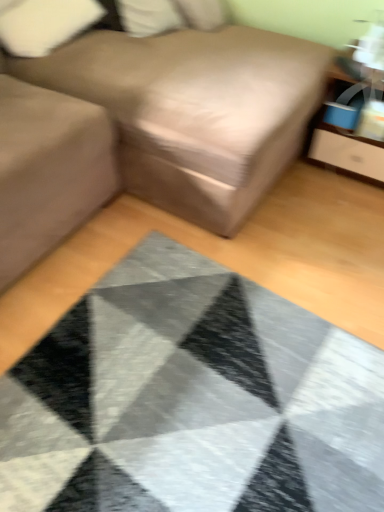
Question: Considering the relative sizes of matte gray sofa at left and white soft pillow at upper center, the first pillow in the right-to-left sequence, in the image provided, is matte gray sofa at left bigger than white soft pillow at upper center, the first pillow in the right-to-left sequence,?

Choices:
 (A) no
 (B) yes

Answer: (B)

Question: From the image's perspective, does matte gray sofa at left appear lower than white soft pillow at upper center, positioned as the 2th pillow in left-to-right order?

Choices:
 (A) yes
 (B) no

Answer: (A)

Question: Is white soft pillow at upper center, positioned as the 2th pillow in left-to-right order, surrounded by matte gray sofa at left?

Choices:
 (A) yes
 (B) no

Answer: (B)

Question: Can you see matte gray sofa at left touching white soft pillow at upper center, positioned as the 2th pillow in left-to-right order?

Choices:
 (A) no
 (B) yes

Answer: (A)

Question: From a real-world perspective, is matte gray sofa at left located higher than white soft pillow at upper center, the first pillow in the right-to-left sequence?

Choices:
 (A) no
 (B) yes

Answer: (A)

Question: Could you tell me if matte gray sofa at left is turned towards white soft pillow at upper center, the first pillow in the right-to-left sequence?

Choices:
 (A) yes
 (B) no

Answer: (B)

Question: Can you confirm if matte wood dresser at upper right is smaller than white fabric pillow at upper left, the first pillow in the left-to-right sequence?

Choices:
 (A) yes
 (B) no

Answer: (B)

Question: From a real-world perspective, is matte wood dresser at upper right on top of white fabric pillow at upper left, placed as the second pillow when sorted from right to left?

Choices:
 (A) yes
 (B) no

Answer: (B)

Question: Does matte wood dresser at upper right have a lesser height compared to white fabric pillow at upper left, the first pillow in the left-to-right sequence?

Choices:
 (A) yes
 (B) no

Answer: (B)

Question: Is matte wood dresser at upper right oriented away from white fabric pillow at upper left, the first pillow in the left-to-right sequence?

Choices:
 (A) yes
 (B) no

Answer: (B)

Question: Does matte wood dresser at upper right lie behind white fabric pillow at upper left, placed as the second pillow when sorted from right to left?

Choices:
 (A) no
 (B) yes

Answer: (A)

Question: Does matte wood dresser at upper right appear on the right side of white fabric pillow at upper left, placed as the second pillow when sorted from right to left?

Choices:
 (A) yes
 (B) no

Answer: (A)

Question: Considering the relative sizes of white soft pillow at upper center, the first pillow in the right-to-left sequence, and brown fabric couch at center in the image provided, is white soft pillow at upper center, the first pillow in the right-to-left sequence, thinner than brown fabric couch at center?

Choices:
 (A) yes
 (B) no

Answer: (A)